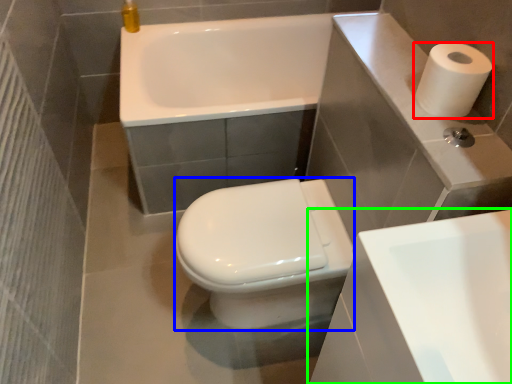
Question: Which is nearer to the paper towel (highlighted by a red box)? bidet (highlighted by a blue box) or sink (highlighted by a green box).

Choices:
 (A) bidet
 (B) sink

Answer: (B)